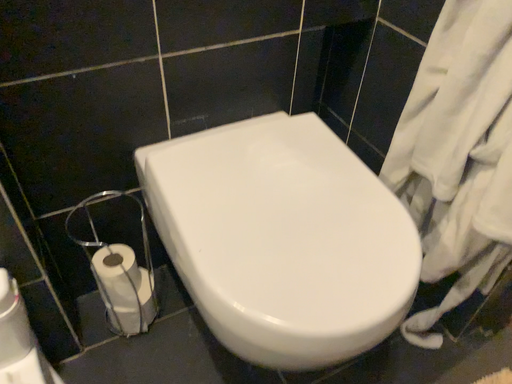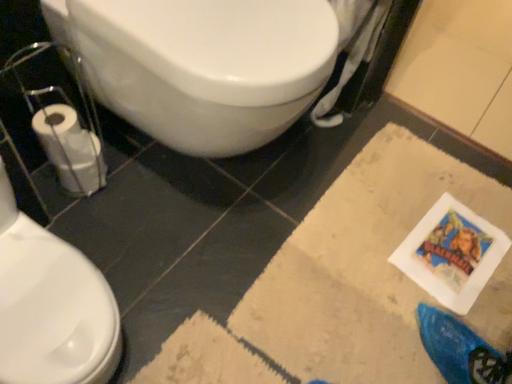
Question: Which way did the camera rotate in the video?

Choices:
 (A) rotated left
 (B) rotated right

Answer: (B)